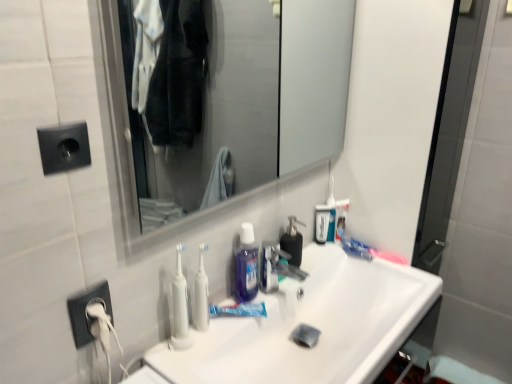
Question: Should I look upward or downward to see pink plastic toothbrush at upper right, placed as the 1th toothbrush when sorted from right to left?

Choices:
 (A) down
 (B) up

Answer: (A)

Question: From the image's perspective, is clear glass mirror at upper center located beneath blue translucent liquid at center, the second mouthwash viewed from the front?

Choices:
 (A) yes
 (B) no

Answer: (B)

Question: Is clear glass mirror at upper center aimed at blue translucent liquid at center, the second mouthwash from the left?

Choices:
 (A) yes
 (B) no

Answer: (B)

Question: Considering the relative sizes of clear glass mirror at upper center and blue translucent liquid at center, which is the second mouthwash from back to front, in the image provided, is clear glass mirror at upper center thinner than blue translucent liquid at center, which is the second mouthwash from back to front,?

Choices:
 (A) yes
 (B) no

Answer: (A)

Question: From a real-world perspective, is clear glass mirror at upper center positioned over blue translucent liquid at center, which is the second mouthwash from back to front, based on gravity?

Choices:
 (A) yes
 (B) no

Answer: (A)

Question: Is clear glass mirror at upper center completely or partially outside of blue translucent liquid at center, the second mouthwash viewed from the front?

Choices:
 (A) no
 (B) yes

Answer: (B)

Question: Is clear glass mirror at upper center closer to camera compared to blue translucent liquid at center, which is the second mouthwash from back to front?

Choices:
 (A) yes
 (B) no

Answer: (A)

Question: Considering the relative sizes of translucent purple mouthwash at center, positioned as the first mouthwash in left-to-right order, and transparent plastic mouthwash at center, the 3th mouthwash positioned from the front, in the image provided, is translucent purple mouthwash at center, positioned as the first mouthwash in left-to-right order, bigger than transparent plastic mouthwash at center, the 3th mouthwash positioned from the front,?

Choices:
 (A) no
 (B) yes

Answer: (B)

Question: Is translucent purple mouthwash at center, positioned as the first mouthwash in left-to-right order, directly adjacent to transparent plastic mouthwash at center, acting as the first mouthwash starting from the right?

Choices:
 (A) yes
 (B) no

Answer: (B)

Question: Would you say transparent plastic mouthwash at center, the 3th mouthwash positioned from the front, is part of translucent purple mouthwash at center, which is the first mouthwash from front to back,'s contents?

Choices:
 (A) no
 (B) yes

Answer: (A)

Question: Can you confirm if translucent purple mouthwash at center, arranged as the third mouthwash when viewed from the right, is positioned to the left of transparent plastic mouthwash at center, placed as the 1th mouthwash when sorted from back to front?

Choices:
 (A) yes
 (B) no

Answer: (A)

Question: Is translucent purple mouthwash at center, positioned as the first mouthwash in left-to-right order, taller than transparent plastic mouthwash at center, the 3th mouthwash positioned from the front?

Choices:
 (A) yes
 (B) no

Answer: (A)

Question: From a real-world perspective, is translucent purple mouthwash at center, which is the first mouthwash from front to back, positioned over transparent plastic mouthwash at center, placed as the 1th mouthwash when sorted from back to front, based on gravity?

Choices:
 (A) yes
 (B) no

Answer: (A)

Question: Can you confirm if clear glass mirror at upper center is shorter than black matte soap dispenser at center?

Choices:
 (A) yes
 (B) no

Answer: (B)